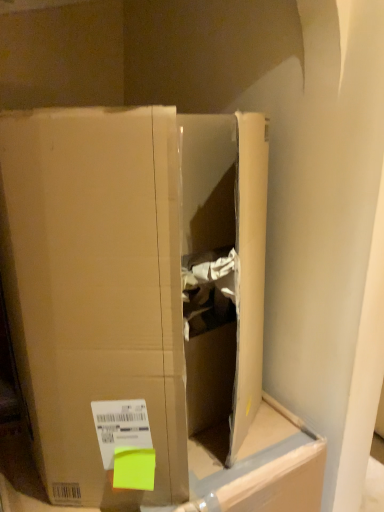
You are a GUI agent. You are given a task and a screenshot of the screen. Output one action in this format:
    pyautogui.click(x=<x>, y=<y>)
    Task: Click on the brown cardboard box at center
    The width and height of the screenshot is (384, 512).
    Given the screenshot: What is the action you would take?
    click(x=132, y=288)

The image size is (384, 512). What do you see at coordinates (132, 288) in the screenshot? I see `brown cardboard box at center` at bounding box center [132, 288].

This screenshot has width=384, height=512. In order to click on brown cardboard box at center in this screenshot , I will do `click(132, 288)`.